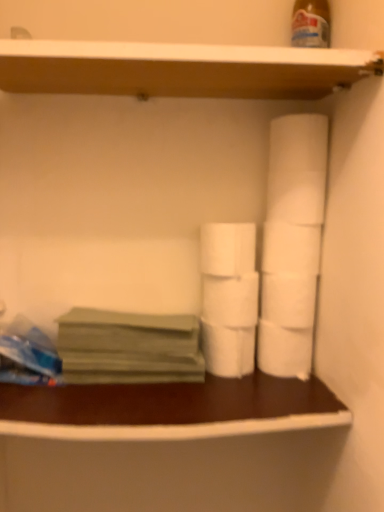
The image size is (384, 512). In order to click on white matte toilet paper at center-right, placed as the 6th toilet paper when sorted from bottom to top in this screenshot , I will do `click(291, 248)`.

What do you see at coordinates (228, 249) in the screenshot? I see `white matte toilet paper at center, arranged as the fifth toilet paper when ordered from the bottom` at bounding box center [228, 249].

This screenshot has height=512, width=384. What are the coordinates of `white matte toilet paper at center, marked as the second toilet paper in a bottom-to-top arrangement` in the screenshot? It's located at (228, 349).

What do you see at coordinates (228, 349) in the screenshot? I see `white matte toilet paper at center, marked as the second toilet paper in a bottom-to-top arrangement` at bounding box center [228, 349].

You are a GUI agent. You are given a task and a screenshot of the screen. Output one action in this format:
    pyautogui.click(x=<x>, y=<y>)
    Task: Click on the white matte toilet paper at right, the sixth toilet paper from the top
    The width and height of the screenshot is (384, 512).
    Given the screenshot: What is the action you would take?
    pyautogui.click(x=284, y=350)

In the scene shown: Is white matte toilet paper at center, the 2th toilet paper when ordered from top to bottom, in contact with wooden at upper center?

No, white matte toilet paper at center, the 2th toilet paper when ordered from top to bottom, is not touching wooden at upper center.

Identify the location of the 2nd toilet paper below the wooden at upper center (from a real-world perspective). The width and height of the screenshot is (384, 512). (228, 249).

From a real-world perspective, does white matte toilet paper at center, arranged as the fifth toilet paper when ordered from the bottom, stand above wooden at upper center?

Actually, white matte toilet paper at center, arranged as the fifth toilet paper when ordered from the bottom, is physically below wooden at upper center in the real world.

Visually, is white matte toilet paper at center, arranged as the fifth toilet paper when ordered from the bottom, positioned to the left or to the right of wooden at upper center?

white matte toilet paper at center, arranged as the fifth toilet paper when ordered from the bottom, is positioned on wooden at upper center's right side.

Considering the positions of objects brown wood counter at lower center and white matte toilet paper at center, the 2th toilet paper when ordered from top to bottom, in the image provided, who is more to the left, brown wood counter at lower center or white matte toilet paper at center, the 2th toilet paper when ordered from top to bottom,?

From the viewer's perspective, brown wood counter at lower center appears more on the left side.

Is brown wood counter at lower center bigger or smaller than white matte toilet paper at center, the 2th toilet paper when ordered from top to bottom?

In the image, brown wood counter at lower center appears to be larger than white matte toilet paper at center, the 2th toilet paper when ordered from top to bottom.

From a real-world perspective, is brown wood counter at lower center above or below white matte toilet paper at center, the 2th toilet paper when ordered from top to bottom?

In terms of real-world spatial position, brown wood counter at lower center is below white matte toilet paper at center, the 2th toilet paper when ordered from top to bottom.

Identify the location of counter beneath the white matte toilet paper at right, positioned as the 3th toilet paper in bottom-to-top order (from a real-world perspective). (169, 409).

From a real-world perspective, is brown wood counter at lower center physically located above or below white matte toilet paper at right, placed as the 4th toilet paper when sorted from top to bottom?

In terms of real-world spatial position, brown wood counter at lower center is below white matte toilet paper at right, placed as the 4th toilet paper when sorted from top to bottom.

Between brown wood counter at lower center and white matte toilet paper at right, positioned as the 3th toilet paper in bottom-to-top order, which one is positioned in front?

brown wood counter at lower center is closer to the camera.

Considering the relative sizes of brown wood counter at lower center and white matte toilet paper at right, positioned as the 3th toilet paper in bottom-to-top order, in the image provided, is brown wood counter at lower center wider than white matte toilet paper at right, positioned as the 3th toilet paper in bottom-to-top order,?

Correct, the width of brown wood counter at lower center exceeds that of white matte toilet paper at right, positioned as the 3th toilet paper in bottom-to-top order.

Who is shorter, white matte toilet paper at center, positioned as the third toilet paper in top-to-bottom order, or white matte toilet paper at right, positioned as the 3th toilet paper in bottom-to-top order?

With less height is white matte toilet paper at center, positioned as the third toilet paper in top-to-bottom order.

How distant is white matte toilet paper at center, positioned as the third toilet paper in top-to-bottom order, from white matte toilet paper at right, placed as the 4th toilet paper when sorted from top to bottom?

2.77 inches.

Is white matte toilet paper at center, which ranks as the fourth toilet paper in bottom-to-top order, outside of white matte toilet paper at right, placed as the 4th toilet paper when sorted from top to bottom?

That's correct, white matte toilet paper at center, which ranks as the fourth toilet paper in bottom-to-top order, is outside of white matte toilet paper at right, placed as the 4th toilet paper when sorted from top to bottom.

Considering the relative sizes of white matte toilet paper at center, positioned as the third toilet paper in top-to-bottom order, and white matte toilet paper at right, positioned as the 3th toilet paper in bottom-to-top order, in the image provided, is white matte toilet paper at center, positioned as the third toilet paper in top-to-bottom order, thinner than white matte toilet paper at right, positioned as the 3th toilet paper in bottom-to-top order,?

No, white matte toilet paper at center, positioned as the third toilet paper in top-to-bottom order, is not thinner than white matte toilet paper at right, positioned as the 3th toilet paper in bottom-to-top order.

Are wooden at upper center and brown wood counter at lower center beside each other?

wooden at upper center and brown wood counter at lower center are clearly separated.

Is brown wood counter at lower center completely or partially inside wooden at upper center?

No, brown wood counter at lower center is not inside wooden at upper center.

In order to click on counter on the left of wooden at upper center in this screenshot , I will do `click(169, 409)`.

Measure the distance from wooden at upper center to brown wood counter at lower center.

wooden at upper center and brown wood counter at lower center are 20.93 inches apart.

Which object is wider, brown wood counter at lower center or wooden at upper center?

Wider between the two is wooden at upper center.

Is brown wood counter at lower center next to wooden at upper center and touching it?

brown wood counter at lower center and wooden at upper center are not in contact.

Which object is positioned more to the right, brown wood counter at lower center or wooden at upper center?

wooden at upper center is more to the right.

From a real-world perspective, which object stands above the other?

wooden at upper center, from a real-world perspective.

Which point is more distant from viewer, [282,244] or [158,337]?

Positioned behind is point [282,244].

Considering the sizes of objects white matte toilet paper at center-right, placed as the 6th toilet paper when sorted from bottom to top, and green matte paper at left in the image provided, who is bigger, white matte toilet paper at center-right, placed as the 6th toilet paper when sorted from bottom to top, or green matte paper at left?

green matte paper at left is bigger.

How far apart are white matte toilet paper at center-right, placed as the 6th toilet paper when sorted from bottom to top, and green matte paper at left?

A distance of 28.60 centimeters exists between white matte toilet paper at center-right, placed as the 6th toilet paper when sorted from bottom to top, and green matte paper at left.

Image resolution: width=384 pixels, height=512 pixels. In order to click on shelf above the white matte toilet paper at center, the 2th toilet paper when ordered from top to bottom (from the image's perspective) in this screenshot , I will do `click(180, 69)`.

I want to click on counter that appears below the white matte toilet paper at center, the 2th toilet paper when ordered from top to bottom (from a real-world perspective), so pyautogui.click(x=169, y=409).

Estimate the real-world distances between objects in this image. Which object is closer to white matte toilet paper at center, the 2th toilet paper when ordered from top to bottom, white matte toilet paper at center, marked as the second toilet paper in a bottom-to-top arrangement, or white matte toilet paper at center-right, placed as the 6th toilet paper when sorted from bottom to top?

white matte toilet paper at center-right, placed as the 6th toilet paper when sorted from bottom to top.

Which object lies further to the anchor point brown wood counter at lower center, green matte paper at left or white matte toilet paper at right, positioned as the 3th toilet paper in bottom-to-top order?

white matte toilet paper at right, positioned as the 3th toilet paper in bottom-to-top order, lies further to brown wood counter at lower center than the other object.

Which object lies nearer to the anchor point white matte toilet paper at center, positioned as the 5th toilet paper in top-to-bottom order, white matte toilet paper at center, the 2th toilet paper when ordered from top to bottom, or white matte toilet paper at right, placed as the 4th toilet paper when sorted from top to bottom?

Based on the image, white matte toilet paper at right, placed as the 4th toilet paper when sorted from top to bottom, appears to be nearer to white matte toilet paper at center, positioned as the 5th toilet paper in top-to-bottom order.

Based on their spatial positions, is white matte toilet paper at center, which ranks as the fourth toilet paper in bottom-to-top order, or wooden at upper center further from green matte paper at left?

wooden at upper center.

Estimate the real-world distances between objects in this image. Which object is closer to wooden at upper center, green matte paper at left or white matte toilet paper at center, positioned as the third toilet paper in top-to-bottom order?

white matte toilet paper at center, positioned as the third toilet paper in top-to-bottom order, lies closer to wooden at upper center than the other object.

Consider the image. When comparing their distances from white matte toilet paper at center-right, which is the first toilet paper in top-to-bottom order, does white matte toilet paper at right, positioned as the 3th toilet paper in bottom-to-top order, or green matte paper at left seem closer?

white matte toilet paper at right, positioned as the 3th toilet paper in bottom-to-top order, is positioned closer to the anchor white matte toilet paper at center-right, which is the first toilet paper in top-to-bottom order.

Considering their positions, is brown wood counter at lower center positioned further to white matte toilet paper at right, the sixth toilet paper from the top, than white matte toilet paper at right, positioned as the 3th toilet paper in bottom-to-top order?

brown wood counter at lower center is further to white matte toilet paper at right, the sixth toilet paper from the top.

Based on their spatial positions, is white matte toilet paper at center, marked as the second toilet paper in a bottom-to-top arrangement, or white matte toilet paper at center-right, placed as the 6th toilet paper when sorted from bottom to top, closer to green matte paper at left?

white matte toilet paper at center, marked as the second toilet paper in a bottom-to-top arrangement, is positioned closer to the anchor green matte paper at left.

Where is `counter between green matte paper at left and white matte toilet paper at center-right, which is the first toilet paper in top-to-bottom order`? The image size is (384, 512). counter between green matte paper at left and white matte toilet paper at center-right, which is the first toilet paper in top-to-bottom order is located at coordinates (169, 409).

You are a GUI agent. You are given a task and a screenshot of the screen. Output one action in this format:
    pyautogui.click(x=<x>, y=<y>)
    Task: Click on the toilet paper that lies between wooden at upper center and white matte toilet paper at center, arranged as the fifth toilet paper when ordered from the bottom, from top to bottom
    This screenshot has height=512, width=384.
    Given the screenshot: What is the action you would take?
    pyautogui.click(x=291, y=248)

You are a GUI agent. You are given a task and a screenshot of the screen. Output one action in this format:
    pyautogui.click(x=<x>, y=<y>)
    Task: Click on the counter situated between green matte paper at left and white matte toilet paper at right, placed as the 4th toilet paper when sorted from top to bottom, from left to right
    The width and height of the screenshot is (384, 512).
    Given the screenshot: What is the action you would take?
    pyautogui.click(x=169, y=409)

You are a GUI agent. You are given a task and a screenshot of the screen. Output one action in this format:
    pyautogui.click(x=<x>, y=<y>)
    Task: Click on the paperback book between wooden at upper center and brown wood counter at lower center from top to bottom
    
    Given the screenshot: What is the action you would take?
    pyautogui.click(x=129, y=347)